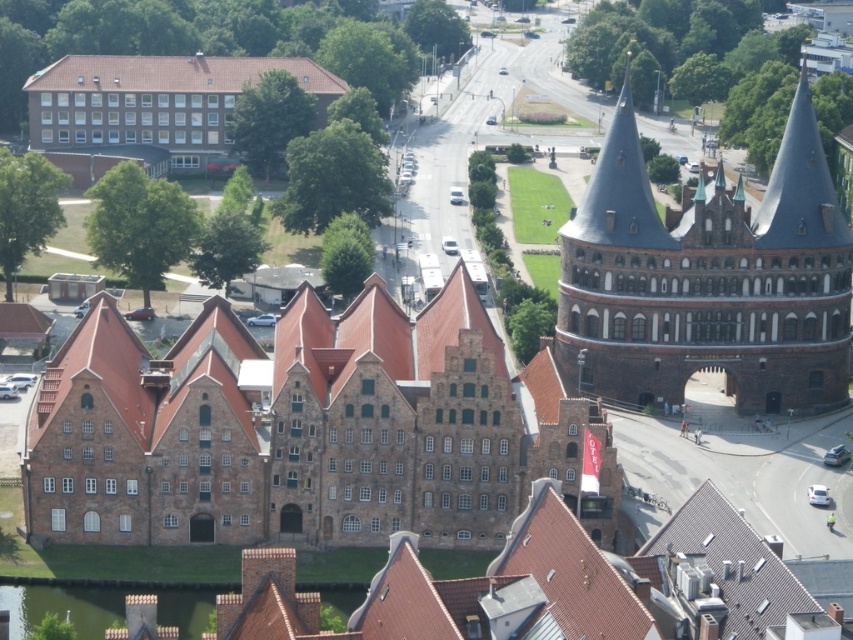
Question: Does brown stone building at center-left have a larger size compared to dark gray stone tower at upper right?

Choices:
 (A) no
 (B) yes

Answer: (A)

Question: In this image, where is brown stone building at center-left located relative to dark gray stone tower at upper right?

Choices:
 (A) below
 (B) above

Answer: (A)

Question: Among these points, which one is farthest from the camera?

Choices:
 (A) (274, 368)
 (B) (698, 259)

Answer: (B)

Question: Does brown stone building at center-left have a larger size compared to dark gray stone tower at upper right?

Choices:
 (A) no
 (B) yes

Answer: (A)